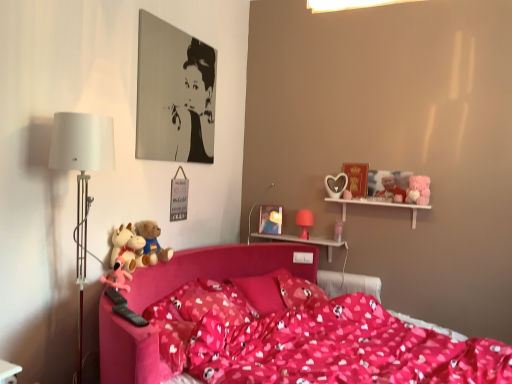
Question: Does point (389, 185) appear closer or farther from the camera than point (415, 200)?

Choices:
 (A) closer
 (B) farther

Answer: (B)

Question: In terms of height, does smooth plastic santa claus at upper right, placed as the 4th toy when sorted from left to right, look taller or shorter compared to fluffy pink teddy bear at upper right?

Choices:
 (A) short
 (B) tall

Answer: (B)

Question: Estimate the real-world distances between objects in this image. Which object is closer to the pink matte table lamp at upper right, which is the second table lamp from front to back?

Choices:
 (A) fluffy pink teddy bear at upper right
 (B) white wooden shelf at upper right
 (C) pink fabric pillow at center, the 1th pillow viewed from the back
 (D) matte plastic picture frame at upper center
 (E) pink rubber duck at left, the fourth toy from the back

Answer: (D)

Question: Based on their relative distances, which object is nearer to the fluffy pink teddy bear at upper right?

Choices:
 (A) matte white lamp at upper center
 (B) fluffy plush toys at left, the third toy in the front-to-back sequence
 (C) pink fabric bed at center
 (D) matte plastic picture frame at upper center
 (E) pink matte table lamp at upper right, positioned as the second table lamp in left-to-right order

Answer: (E)